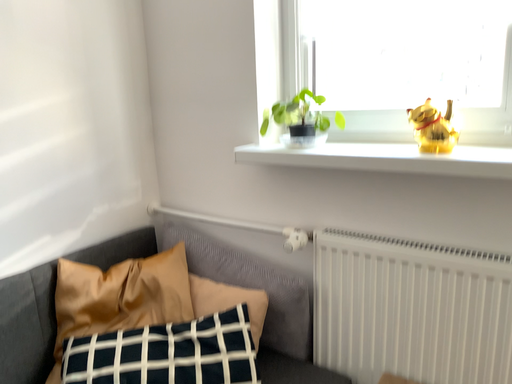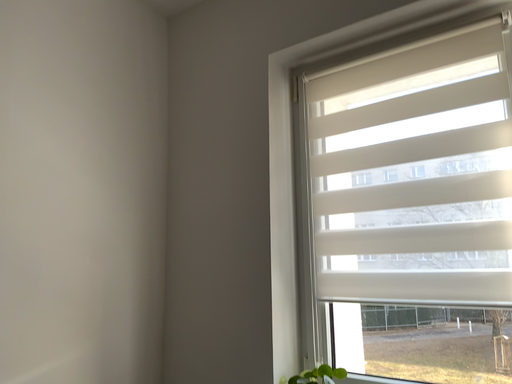
Question: How did the camera likely rotate when shooting the video?

Choices:
 (A) rotated upward
 (B) rotated downward

Answer: (A)